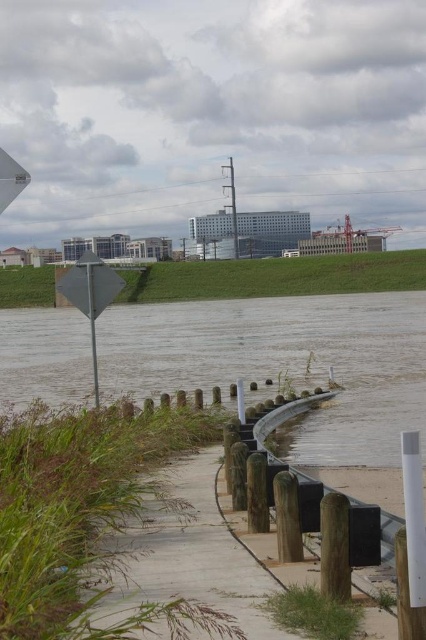
You are standing at the edge of the flooded walkway and want to reach a specific point marked at coordinates point (319, 440). Based on the distance provided, can you estimate whether this point is within a safe walking distance for an average person?

The point (319, 440) is 64.42 feet away from the viewer. Since an average person can walk distances up to 100 feet without difficulty, this point is within a safe walking distance.